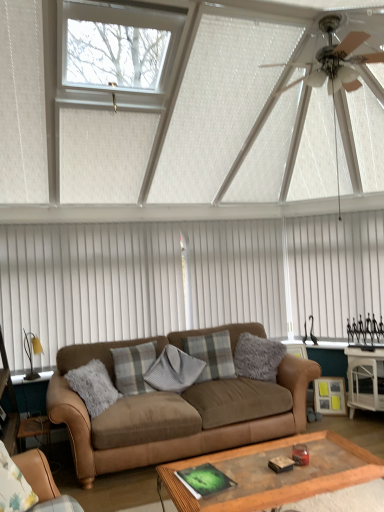
Question: Does brown leather couch at center, acting as the 2th studio couch starting from the front, have a greater width compared to plaid fabric pillow at center, the first pillow when ordered from left to right?

Choices:
 (A) no
 (B) yes

Answer: (B)

Question: Does brown leather couch at center, acting as the 2th studio couch starting from the front, lie in front of plaid fabric pillow at center, which appears as the 4th pillow when viewed from the right?

Choices:
 (A) yes
 (B) no

Answer: (A)

Question: From a real-world perspective, is brown leather couch at center, marked as the first studio couch in a back-to-front arrangement, beneath plaid fabric pillow at center, which appears as the 4th pillow when viewed from the right?

Choices:
 (A) no
 (B) yes

Answer: (B)

Question: Is brown leather couch at center, acting as the 2th studio couch starting from the front, bigger than plaid fabric pillow at center, the first pillow when ordered from left to right?

Choices:
 (A) yes
 (B) no

Answer: (A)

Question: Is brown leather couch at center, acting as the 2th studio couch starting from the front, directly adjacent to plaid fabric pillow at center, which appears as the 4th pillow when viewed from the right?

Choices:
 (A) yes
 (B) no

Answer: (B)

Question: Can you confirm if brown leather couch at center, acting as the 2th studio couch starting from the front, is taller than plaid fabric pillow at center, the first pillow when ordered from left to right?

Choices:
 (A) yes
 (B) no

Answer: (A)

Question: Does fuzzy gray pillow at center, the fourth pillow when ordered from left to right, appear on the left side of clear glass window at upper center?

Choices:
 (A) yes
 (B) no

Answer: (B)

Question: From the image's perspective, is fuzzy gray pillow at center, the fourth pillow when ordered from left to right, over clear glass window at upper center?

Choices:
 (A) no
 (B) yes

Answer: (A)

Question: From a real-world perspective, does fuzzy gray pillow at center, the fourth pillow when ordered from left to right, stand above clear glass window at upper center?

Choices:
 (A) yes
 (B) no

Answer: (B)

Question: Does fuzzy gray pillow at center, which ranks as the 1th pillow in right-to-left order, have a lesser width compared to clear glass window at upper center?

Choices:
 (A) yes
 (B) no

Answer: (A)

Question: Does fuzzy gray pillow at center, the fourth pillow when ordered from left to right, come in front of clear glass window at upper center?

Choices:
 (A) no
 (B) yes

Answer: (A)

Question: Does fuzzy gray pillow at center, the fourth pillow when ordered from left to right, have a smaller size compared to clear glass window at upper center?

Choices:
 (A) yes
 (B) no

Answer: (A)

Question: Does fuzzy gray pillow at center, the fourth pillow when ordered from left to right, have a lesser height compared to white vertical blinds at upper center?

Choices:
 (A) yes
 (B) no

Answer: (A)